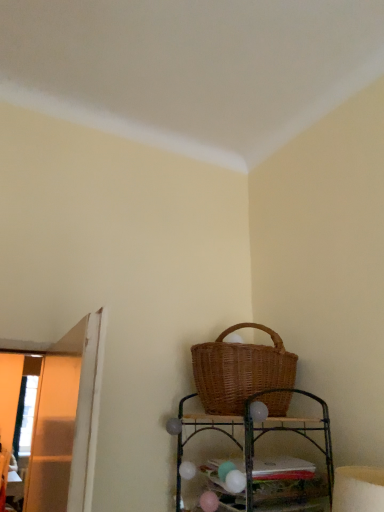
Question: Looking at their shapes, would you say woven wood shelf at lower center is wider or thinner than woven brown picnic basket at upper right?

Choices:
 (A) wide
 (B) thin

Answer: (B)

Question: From their relative heights in the image, would you say woven wood shelf at lower center is taller or shorter than woven brown picnic basket at upper right?

Choices:
 (A) tall
 (B) short

Answer: (A)

Question: Is woven wood shelf at lower center bigger or smaller than woven brown picnic basket at upper right?

Choices:
 (A) small
 (B) big

Answer: (A)

Question: Considering the positions of woven brown picnic basket at upper right and woven wood shelf at lower center in the image, is woven brown picnic basket at upper right taller or shorter than woven wood shelf at lower center?

Choices:
 (A) short
 (B) tall

Answer: (A)

Question: Considering the relative positions of woven brown picnic basket at upper right and woven wood shelf at lower center in the image provided, is woven brown picnic basket at upper right to the left or to the right of woven wood shelf at lower center?

Choices:
 (A) right
 (B) left

Answer: (A)

Question: Based on their sizes in the image, would you say woven brown picnic basket at upper right is bigger or smaller than woven wood shelf at lower center?

Choices:
 (A) small
 (B) big

Answer: (B)

Question: Is point pyautogui.click(x=208, y=372) positioned closer to the camera than point pyautogui.click(x=332, y=459)?

Choices:
 (A) farther
 (B) closer

Answer: (B)